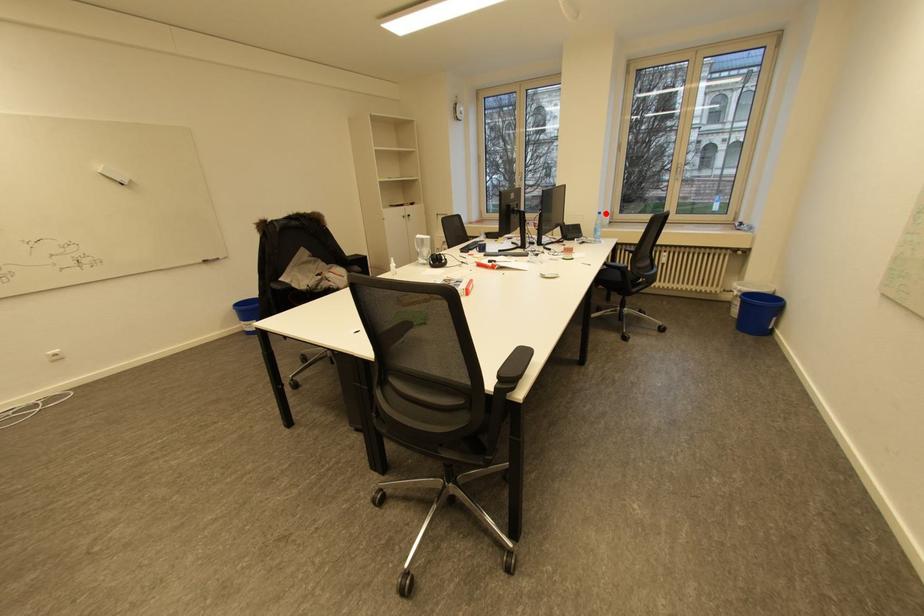
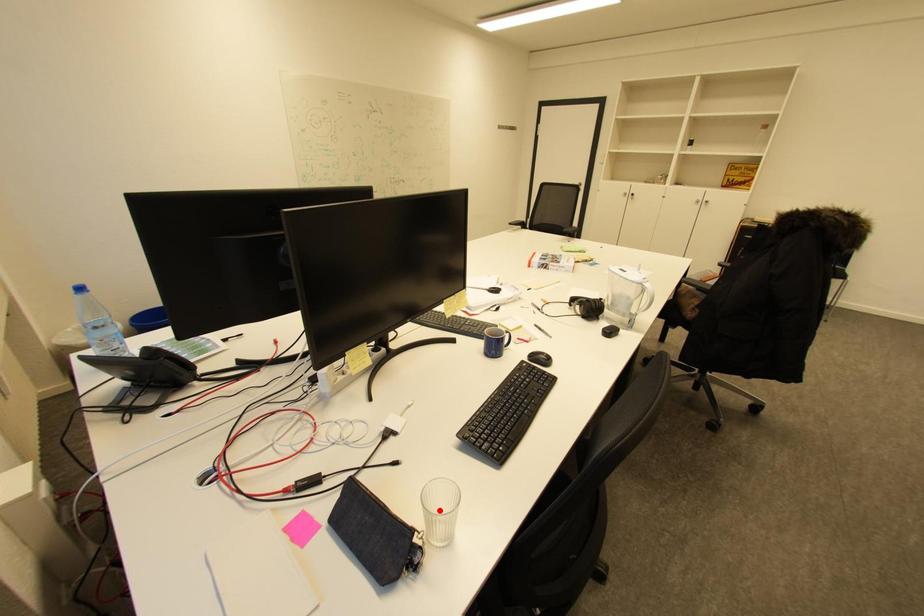
I am providing you with two images of the same scene from different viewpoints. A red point is marked on the first image and another point is marked on the second image. Does the point marked in image1 correspond to the same location as the one in image2?

No